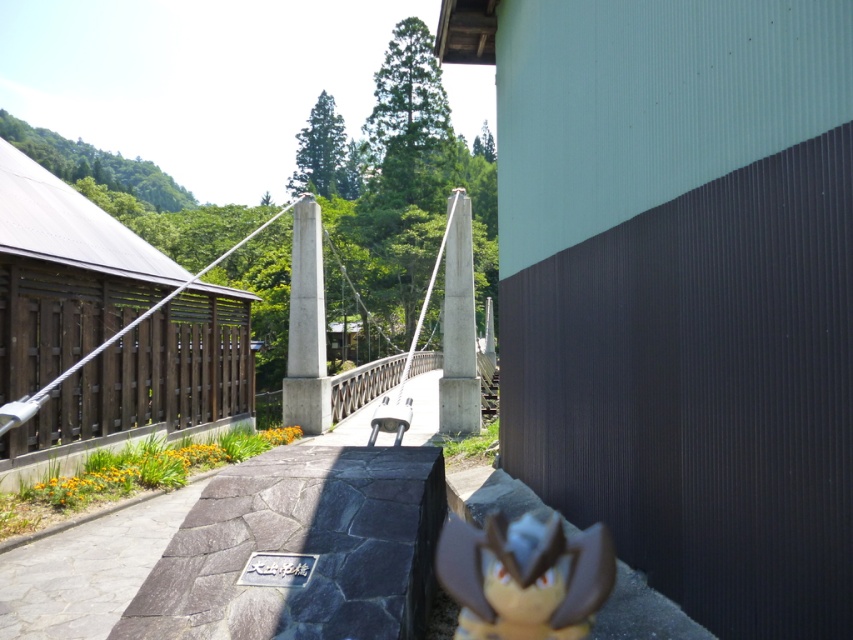
You are a tourist visiting this scenic area and want to rest. You see the silver metallic rail at center and the metallic silver bench at center. Which object is bigger and would provide more space to sit?

The silver metallic rail at center is larger in size than the metallic silver bench at center, but the bench is designed for sitting. The rail is likely for holding, so the bench would be more suitable for sitting despite its smaller size.

You are a child who wants to place the brown matte toy at lower center on the silver metallic rail at center. Based on their sizes, will the toy fit on the rail?

The brown matte toy at lower center is narrower than the silver metallic rail at center, so it should fit comfortably on the rail.